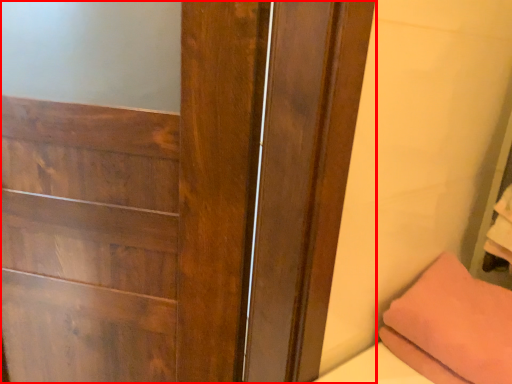
Question: Considering the relative positions of door (annotated by the red box) and pillow in the image provided, where is door (annotated by the red box) located with respect to the staircase?

Choices:
 (A) right
 (B) left

Answer: (B)